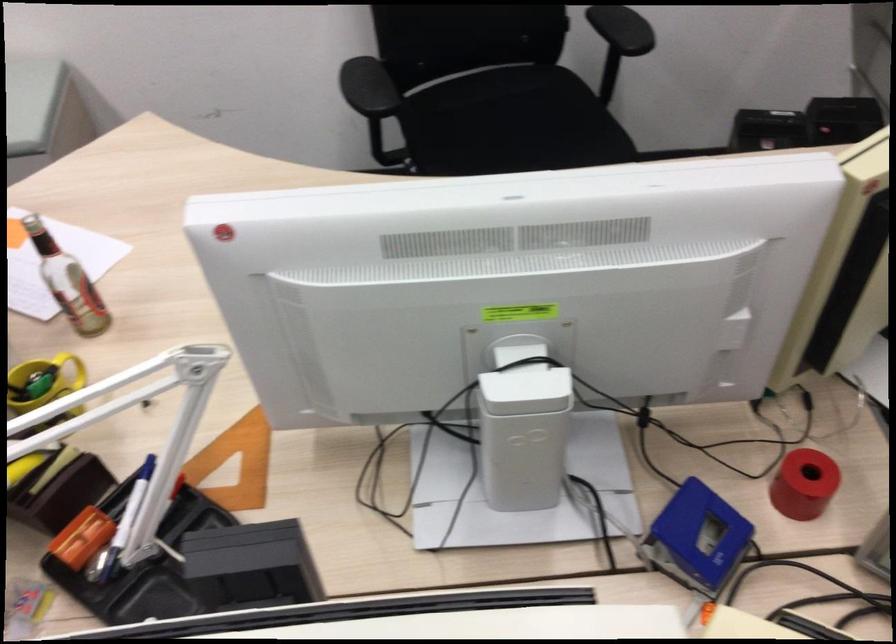
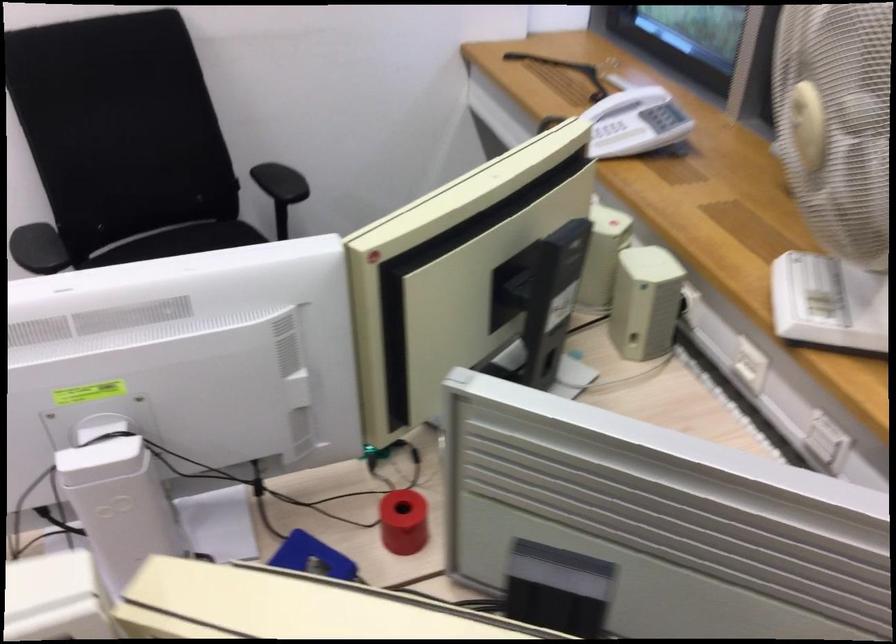
Find the pixel in the second image that matches point 803,487 in the first image.

(403, 522)